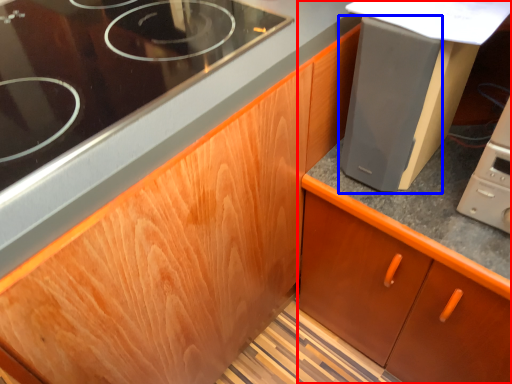
Question: Which object appears farthest to the camera in this image, cabinetry (highlighted by a red box) or appliance (highlighted by a blue box)?

Choices:
 (A) cabinetry
 (B) appliance

Answer: (A)